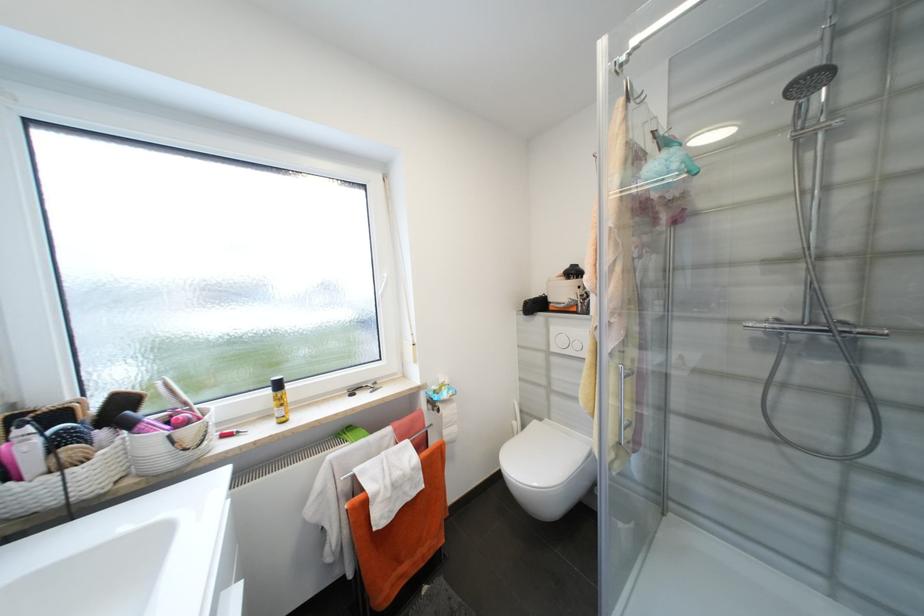
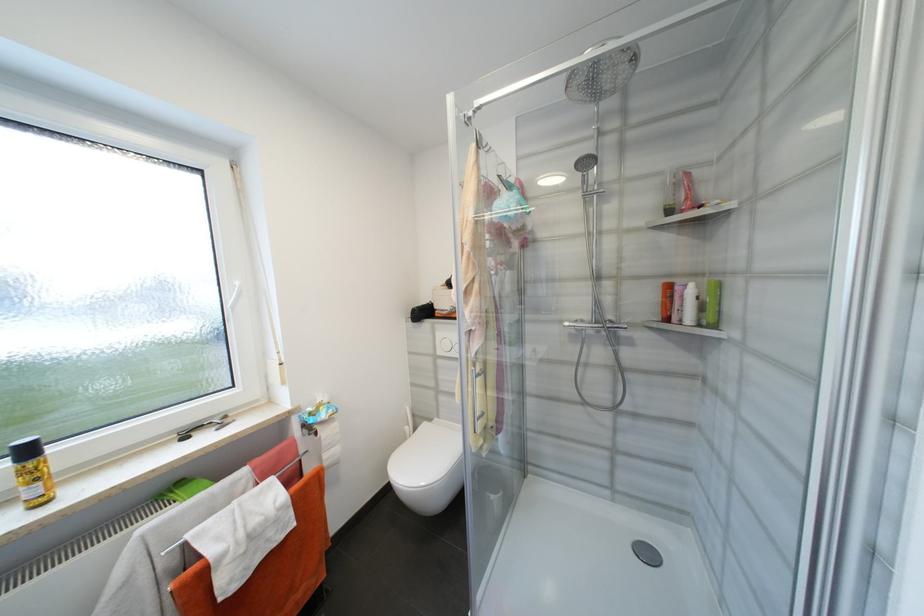
The point at (391, 276) is marked in the first image. Where is the corresponding point in the second image?

(242, 285)